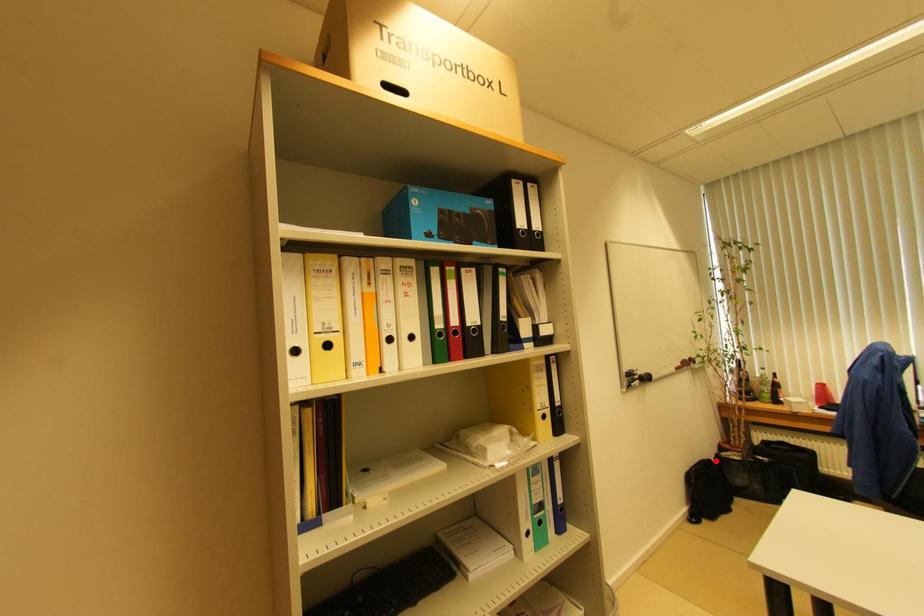
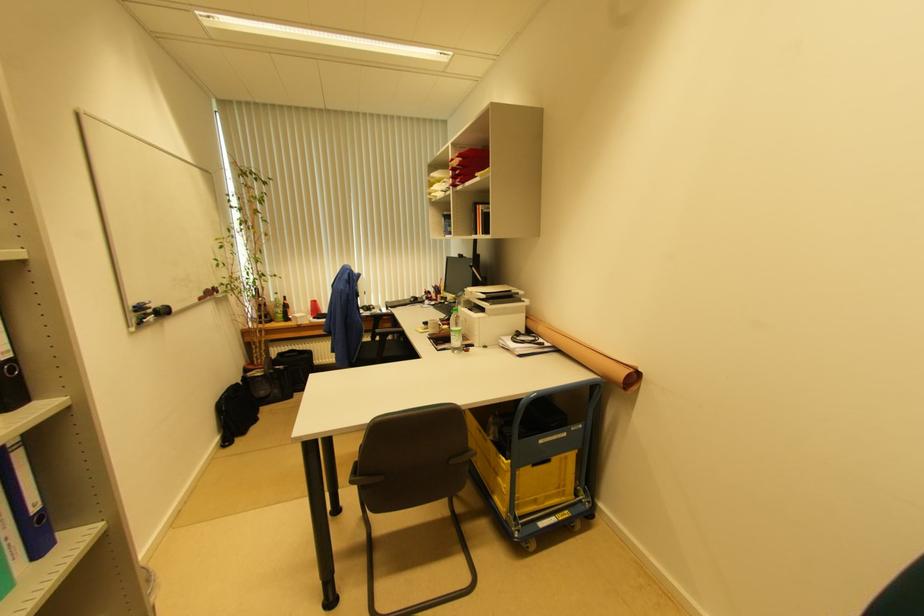
Where in the second image is the point corresponding to the highlighted location from the first image?

(242, 383)